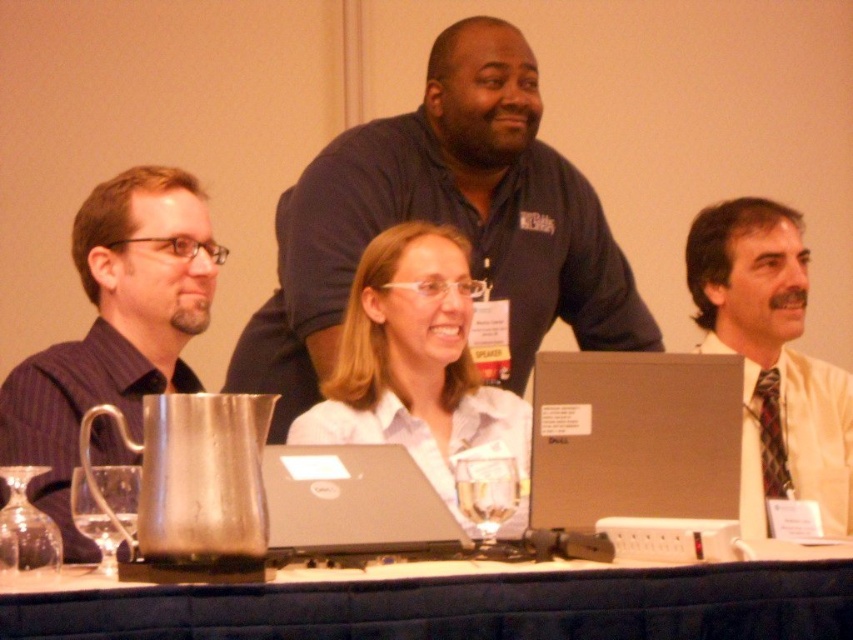
Can you confirm if silver metallic laptop at center is bigger than white shirt at center?

Incorrect, silver metallic laptop at center is not larger than white shirt at center.

Does silver metallic laptop at center have a greater height compared to white shirt at center?

In fact, silver metallic laptop at center may be shorter than white shirt at center.

The height and width of the screenshot is (640, 853). In order to click on silver metallic laptop at center in this screenshot , I will do `click(634, 436)`.

Identify the location of silver metallic laptop at center. (634, 436).

Can you confirm if dark blue striped shirt at left is smaller than white glossy shirt at center?

Correct, dark blue striped shirt at left occupies less space than white glossy shirt at center.

Is dark blue striped shirt at left above white glossy shirt at center?

Yes.

Locate an element on the screen. dark blue striped shirt at left is located at coordinates (115, 326).

Is white glossy shirt at center thinner than black matte laptop at center?

No, white glossy shirt at center is not thinner than black matte laptop at center.

This screenshot has height=640, width=853. I want to click on white glossy shirt at center, so click(418, 369).